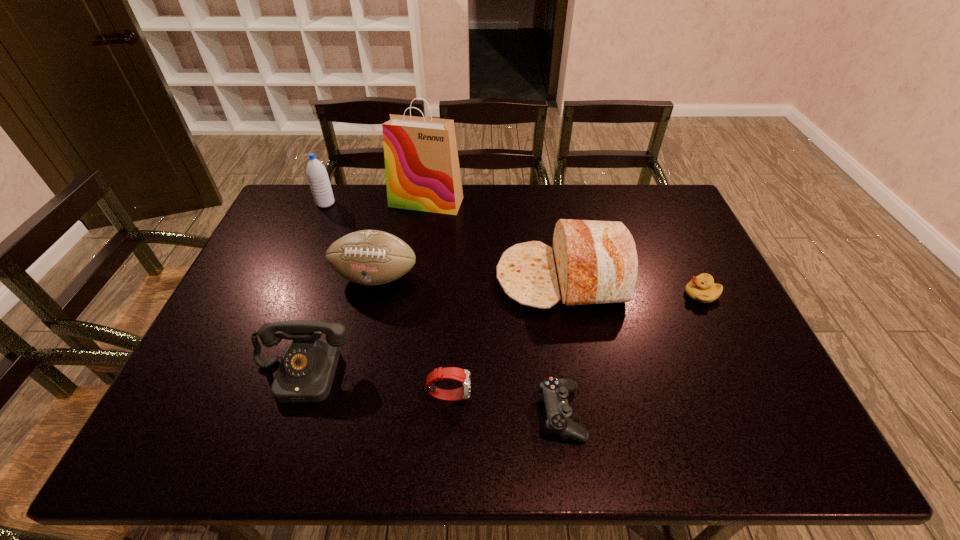
You are a GUI agent. You are given a task and a screenshot of the screen. Output one action in this format:
    pyautogui.click(x=<x>, y=<y>)
    Task: Click on the shopping bag
    
    Given the screenshot: What is the action you would take?
    pyautogui.click(x=422, y=169)

Where is `water bottle`? The width and height of the screenshot is (960, 540). water bottle is located at coordinates (318, 179).

You are a GUI agent. You are given a task and a screenshot of the screen. Output one action in this format:
    pyautogui.click(x=<x>, y=<y>)
    Task: Click on the bread
    The height and width of the screenshot is (540, 960).
    Given the screenshot: What is the action you would take?
    pyautogui.click(x=592, y=262)

Locate an element on the screen. Image resolution: width=960 pixels, height=540 pixels. football (American) is located at coordinates (369, 257).

Locate an element on the screen. The image size is (960, 540). telephone is located at coordinates (305, 375).

Locate an element on the screen. This screenshot has height=540, width=960. watch is located at coordinates (454, 373).

Locate an element on the screen. This screenshot has width=960, height=540. duckling is located at coordinates (702, 288).

Locate an element on the screen. The width and height of the screenshot is (960, 540). the rightmost object is located at coordinates (702, 288).

Find the location of a particular element. the shortest object is located at coordinates (559, 414).

Locate an element on the screen. The height and width of the screenshot is (540, 960). free space located 0.200m on the right of the tallest object is located at coordinates tap(519, 202).